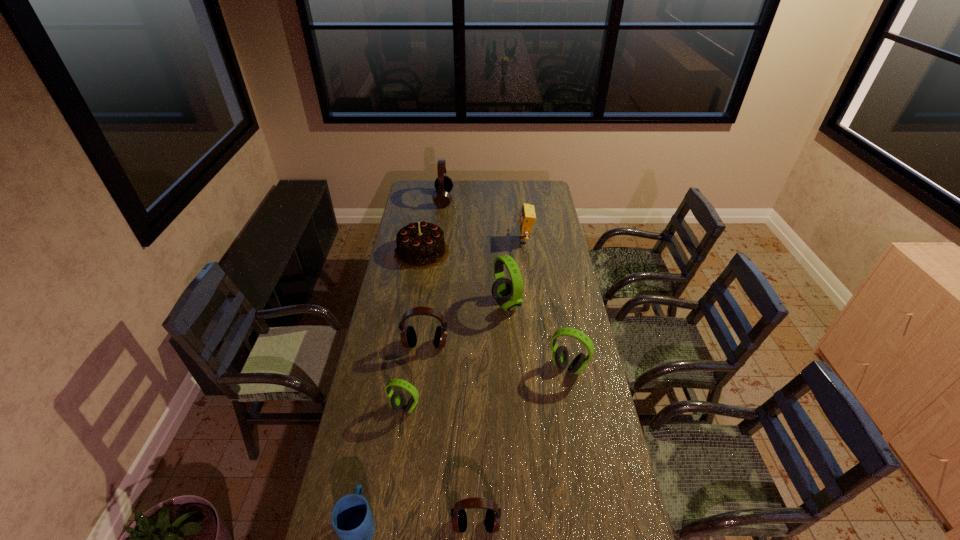
Find the location of a particular element. vacant area that lies between the third nearest object and the nearest black headset is located at coordinates (441, 466).

What are the coordinates of `free space between the fifth nearest object and the smallest black headset` in the screenshot? It's located at (451, 435).

This screenshot has height=540, width=960. In order to click on free space between the nearest black headset and the third nearest headset in this screenshot , I will do `click(522, 446)`.

Locate an element on the screen. free spot between the smallest black headset and the second nearest black headset is located at coordinates (451, 435).

The width and height of the screenshot is (960, 540). In order to click on free point between the second smallest green headset and the sponge in this screenshot , I will do `click(545, 304)`.

Where is `free space that is in between the fourth nearest headset and the farthest black headset`? The height and width of the screenshot is (540, 960). free space that is in between the fourth nearest headset and the farthest black headset is located at coordinates click(435, 272).

You are a GUI agent. You are given a task and a screenshot of the screen. Output one action in this format:
    pyautogui.click(x=<x>, y=<y>)
    Task: Click on the vacant space that is in between the third nearest headset and the biggest green headset
    Image resolution: width=960 pixels, height=540 pixels.
    Given the screenshot: What is the action you would take?
    pyautogui.click(x=538, y=335)

At what (x,y) coordinates should I click in order to perform the action: click on vacant area that lies between the farthest black headset and the smallest black headset. Please return your answer as a coordinate pair (x, y). This screenshot has width=960, height=540. Looking at the image, I should click on (460, 362).

At what (x,y) coordinates should I click in order to perform the action: click on empty space between the second green headset from right to left and the sixth farthest object. Please return your answer as a coordinate pair (x, y). Looking at the image, I should click on (538, 335).

Locate an element on the screen. This screenshot has width=960, height=540. object that is the second closest to the mug is located at coordinates (397, 399).